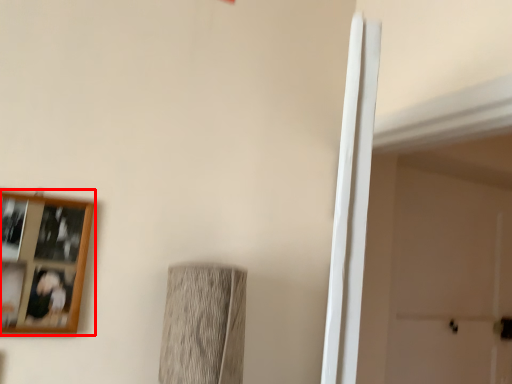
Question: In this image, where is picture frame (annotated by the red box) located relative to door?

Choices:
 (A) right
 (B) left

Answer: (B)